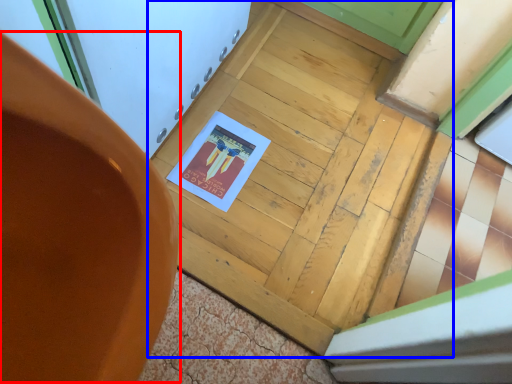
Question: Which object is further to the camera taking this photo, chair (highlighted by a red box) or door (highlighted by a blue box)?

Choices:
 (A) chair
 (B) door

Answer: (B)